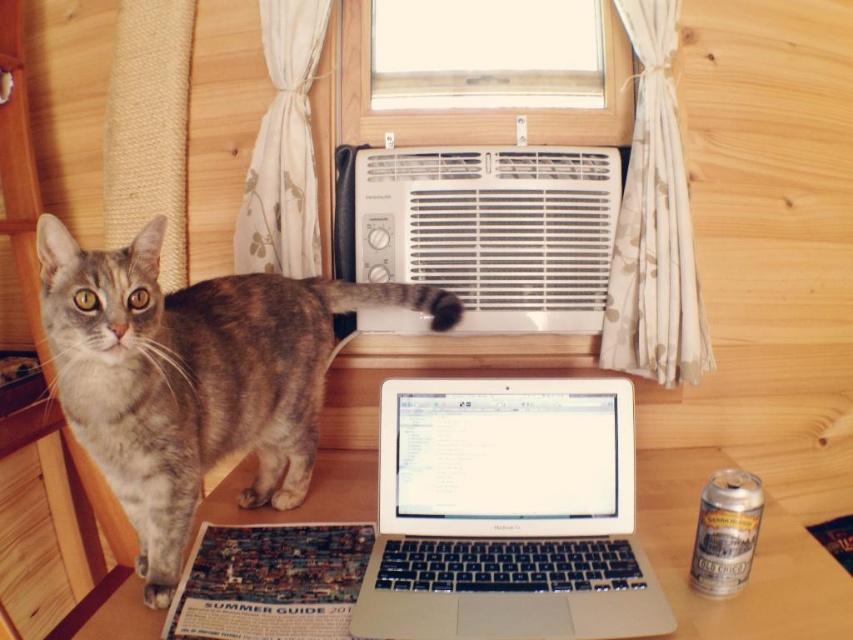
Does silver metallic laptop at center have a lesser height compared to gray tabby cat at left?

Indeed, silver metallic laptop at center has a lesser height compared to gray tabby cat at left.

Is point (379, 582) positioned behind point (67, 392)?

Yes, point (379, 582) is behind point (67, 392).

At what (x,y) coordinates should I click in order to perform the action: click on silver metallic laptop at center. Please return your answer as a coordinate pair (x, y). The height and width of the screenshot is (640, 853). Looking at the image, I should click on click(508, 513).

Is wooden table at center taller than clear glass window at upper center?

No.

Who is taller, wooden table at center or clear glass window at upper center?

clear glass window at upper center

What do you see at coordinates (753, 561) in the screenshot?
I see `wooden table at center` at bounding box center [753, 561].

This screenshot has width=853, height=640. What are the coordinates of `wooden table at center` in the screenshot? It's located at (753, 561).

Is white plastic air conditioner at upper center smaller than wooden table at center?

Yes.

Is white plastic air conditioner at upper center shorter than wooden table at center?

In fact, white plastic air conditioner at upper center may be taller than wooden table at center.

Who is more distant from viewer, (490, 323) or (833, 577)?

The point (490, 323) is behind.

Identify the location of white plastic air conditioner at upper center. tap(492, 228).